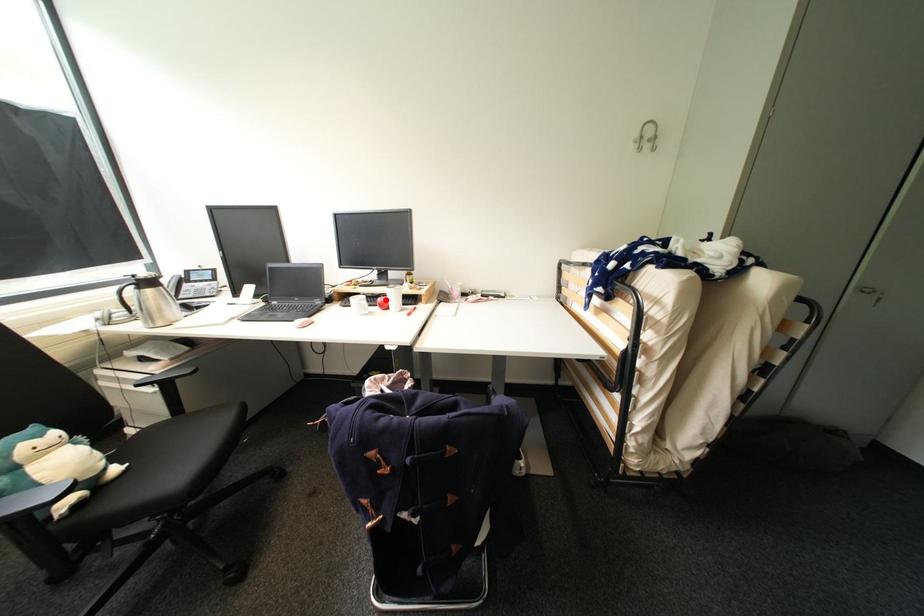
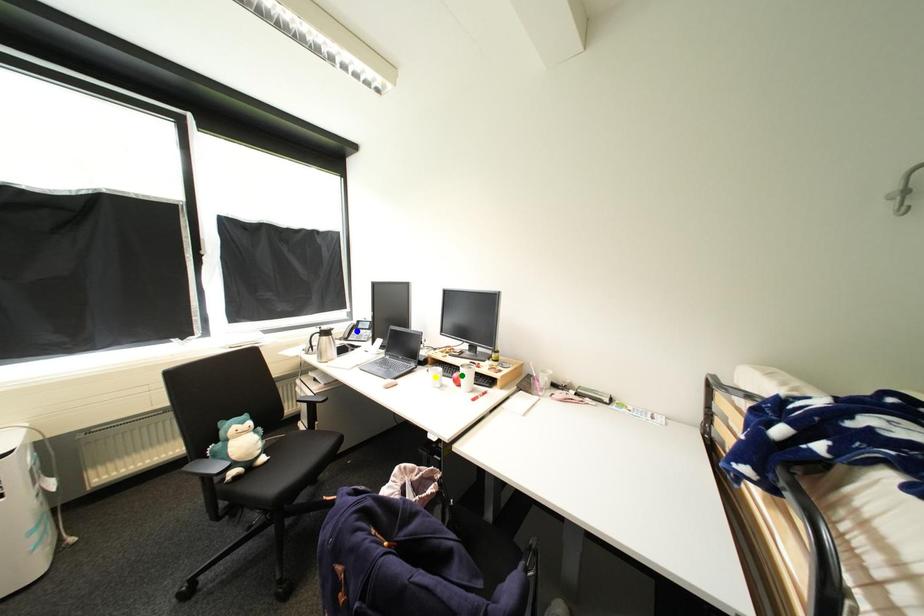
Question: I am providing you with two images of the same scene from different viewpoints. A red point is marked on the first image. You are given multiple points on the second image. Which mark in image 2 goes with the point in image 1?

Choices:
 (A) green point
 (B) yellow point
 (C) blue point

Answer: (A)